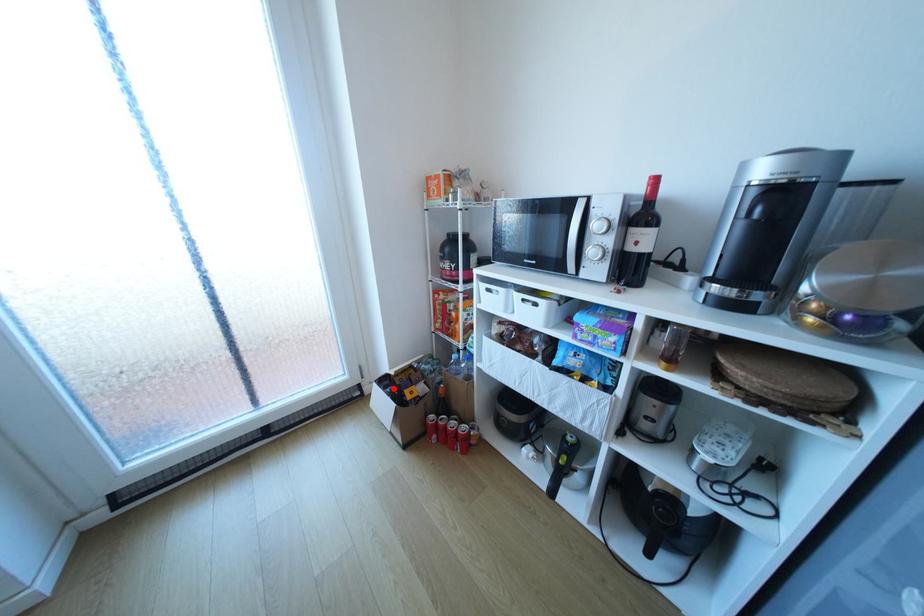
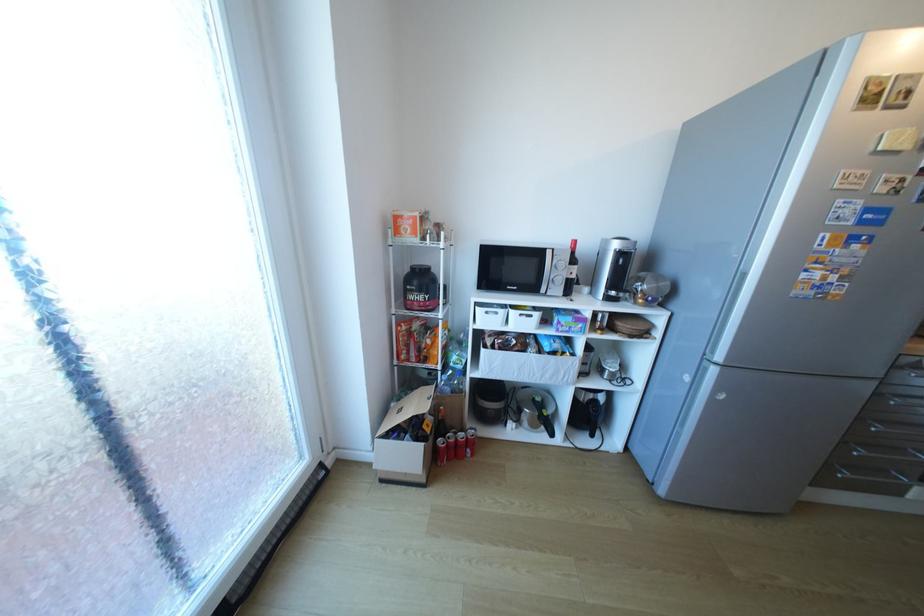
The point at the highlighted location is marked in the first image. Where is the corresponding point in the second image?

(407, 437)